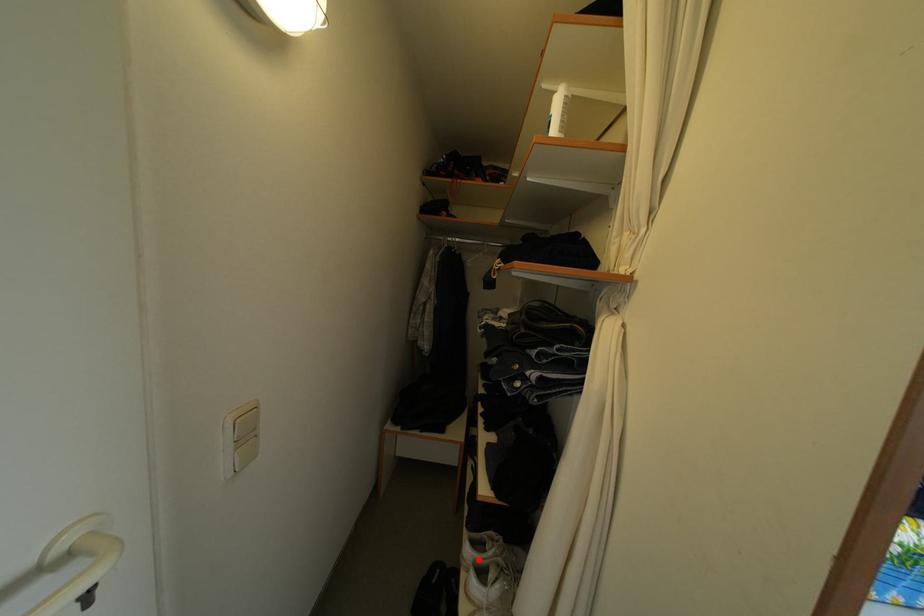
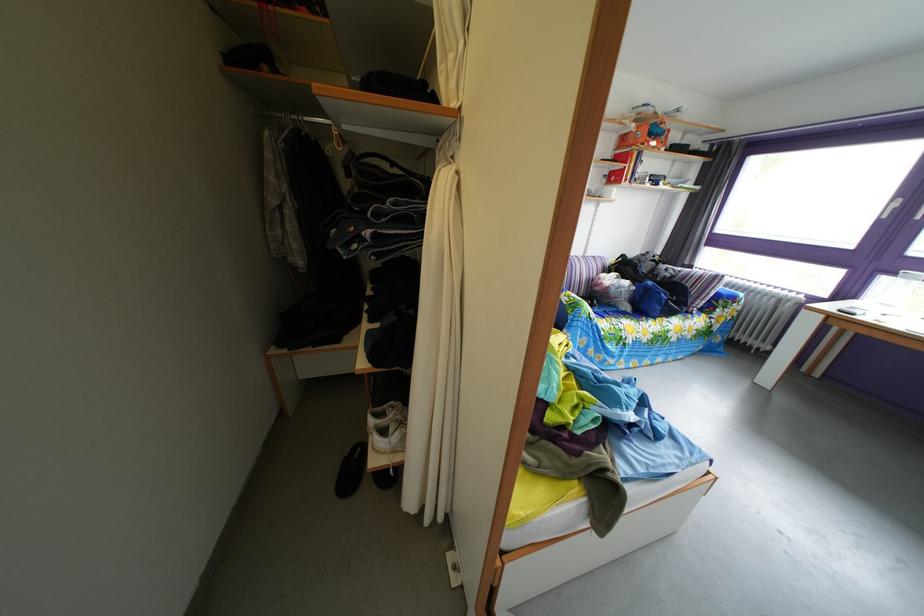
Locate, in the second image, the point that corresponds to the highlighted location in the first image.

(383, 430)